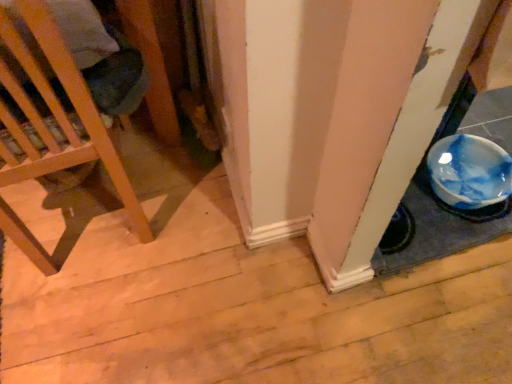
Image resolution: width=512 pixels, height=384 pixels. I want to click on free location in front of wooden chair at left, so click(x=95, y=322).